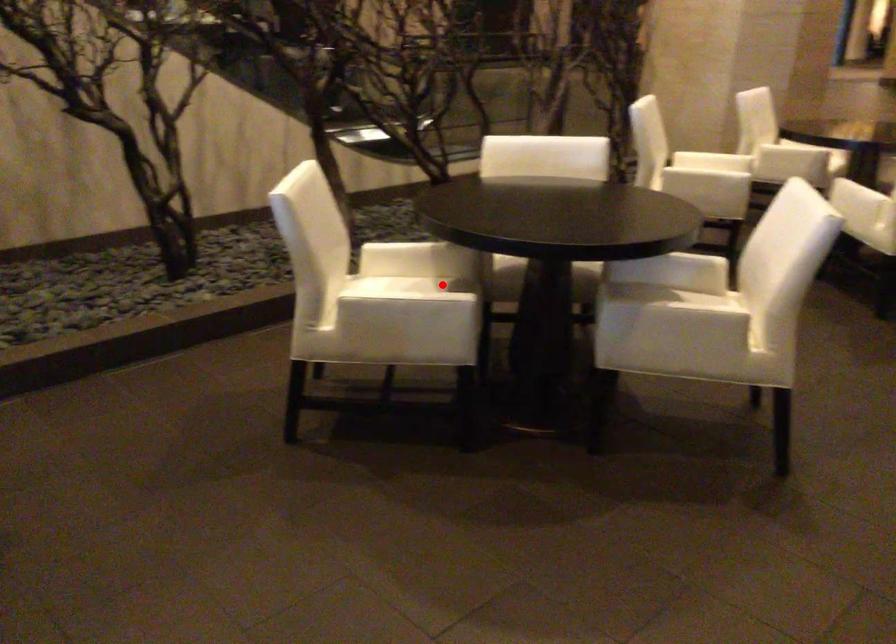
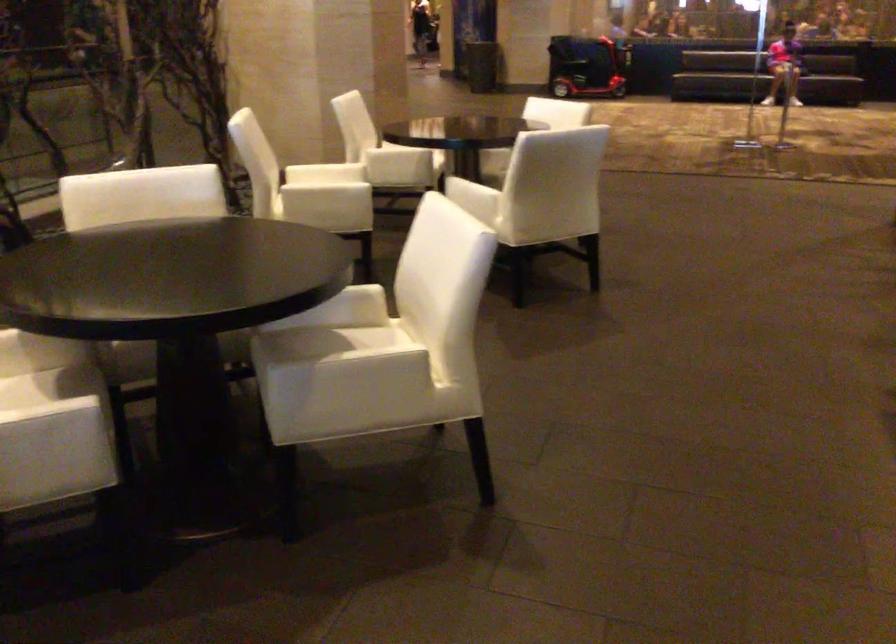
Where in the second image is the point corresponding to the highlighted location from the first image?

(46, 383)